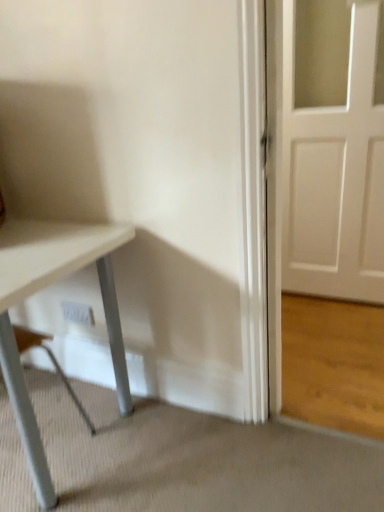
Where is `vacant area located to the right-hand side of white matte table at lower left`? vacant area located to the right-hand side of white matte table at lower left is located at coordinates (114, 445).